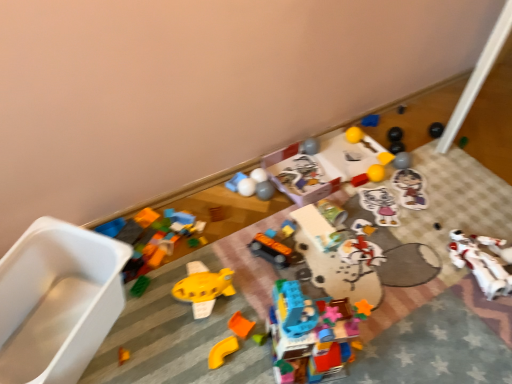
Locate an element on the screen. free space between white plastic container at left, which is counted as the first toy, starting from the left, and yellow matte toy boat at center, positioned as the second toy in left-to-right order is located at coordinates (158, 324).